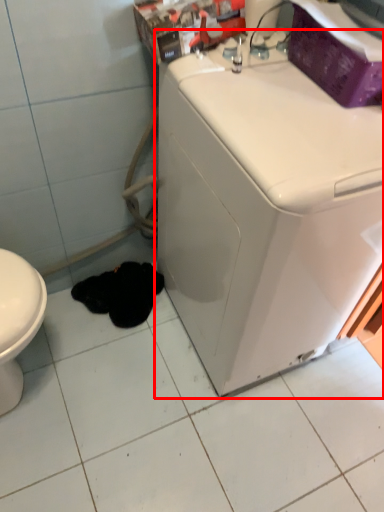
Question: Considering the relative positions of washing machine (annotated by the red box) and animal in the image provided, where is washing machine (annotated by the red box) located with respect to the staircase?

Choices:
 (A) right
 (B) left

Answer: (A)